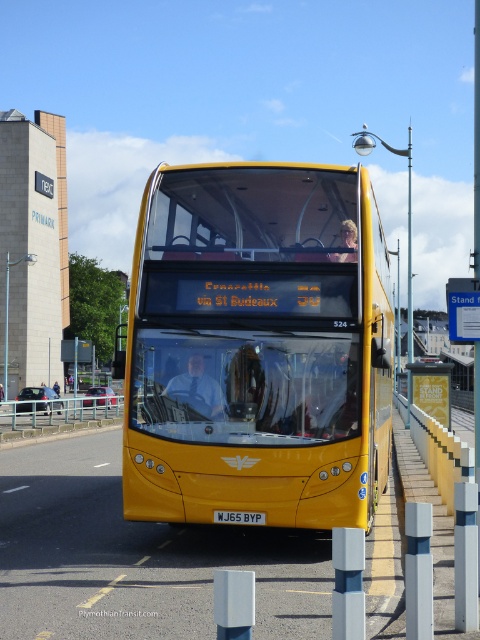
Question: Which point is closer to the camera?

Choices:
 (A) yellow matte/decorative bus at center
 (B) metallic yellow bus stop at right

Answer: (A)

Question: In this image, where is yellow matte/decorative bus at center located relative to metallic yellow bus stop at right?

Choices:
 (A) right
 (B) left

Answer: (B)

Question: In this image, where is yellow matte/decorative bus at center located relative to metallic yellow bus stop at right?

Choices:
 (A) left
 (B) right

Answer: (A)

Question: Can you confirm if yellow matte/decorative bus at center is positioned below metallic yellow bus stop at right?

Choices:
 (A) yes
 (B) no

Answer: (B)

Question: Which point is closer to the camera?

Choices:
 (A) white plastic license plate at center
 (B) yellow matte/decorative bus at center

Answer: (A)

Question: Estimate the real-world distances between objects in this image. Which object is farther from the metallic yellow bus stop at right?

Choices:
 (A) yellow matte/decorative bus at center
 (B) white plastic license plate at center

Answer: (A)